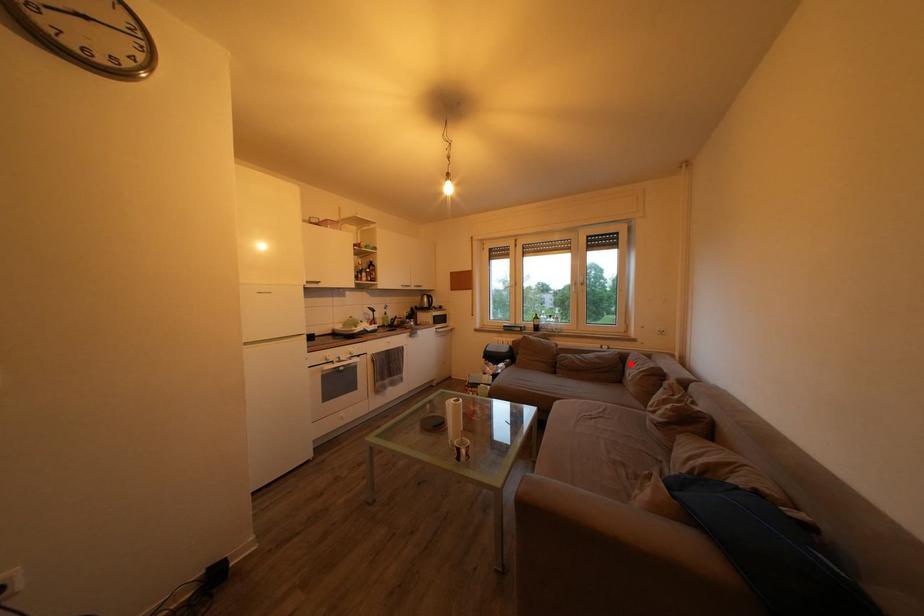
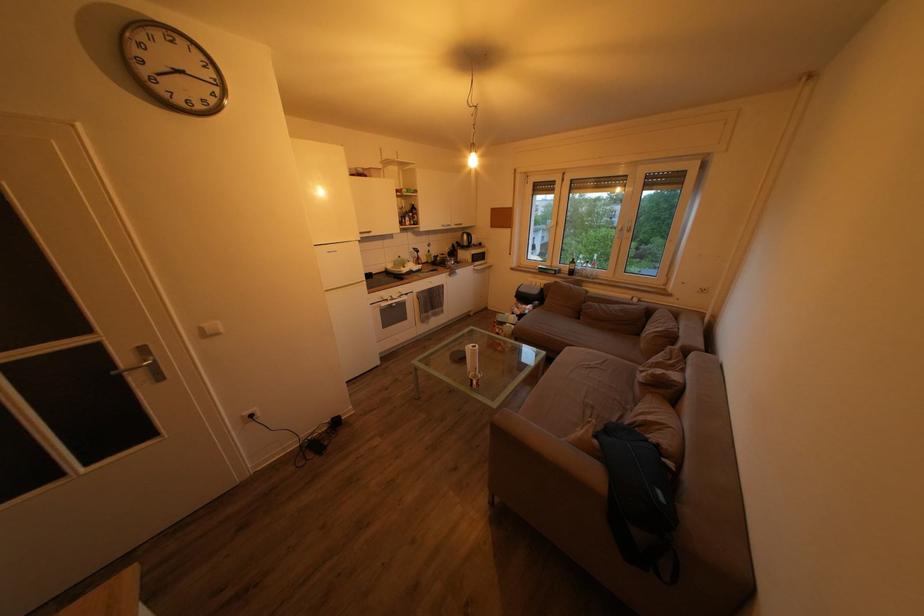
In the second image, find the point that corresponds to the highlighted location in the first image.

(657, 318)